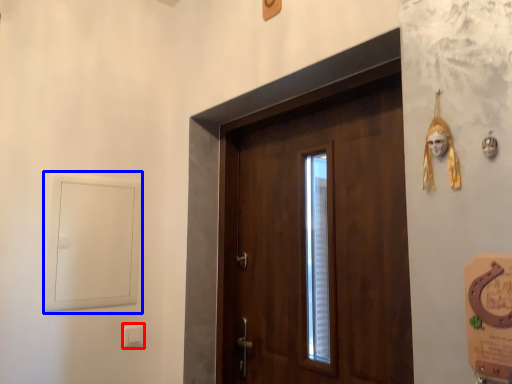
Question: Which object appears closest to the camera in this image, light switch (highlighted by a red box) or window (highlighted by a blue box)?

Choices:
 (A) light switch
 (B) window

Answer: (B)